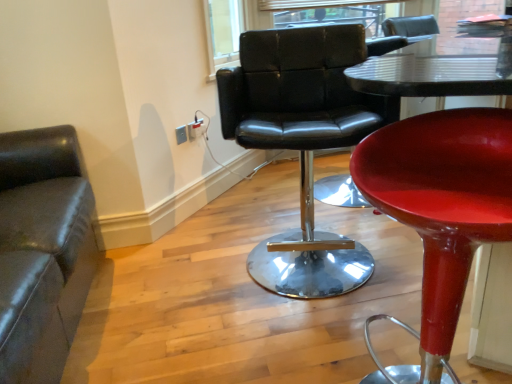
Question: Is black leather chair at center, placed as the second chair when sorted from right to left, at the left side of shiny red stool at center, the third chair when ordered from left to right?

Choices:
 (A) yes
 (B) no

Answer: (A)

Question: Is black leather chair at center, the 2th chair viewed from the left, positioned far away from shiny red stool at center, the third chair when ordered from left to right?

Choices:
 (A) yes
 (B) no

Answer: (B)

Question: Does black leather chair at center, the 2th chair viewed from the left, lie behind shiny red stool at center, the third chair when ordered from left to right?

Choices:
 (A) yes
 (B) no

Answer: (A)

Question: Is black leather chair at center, placed as the second chair when sorted from right to left, looking in the opposite direction of shiny red stool at center, the 1th chair in the right-to-left sequence?

Choices:
 (A) no
 (B) yes

Answer: (A)

Question: Could you tell me if black leather chair at center, placed as the second chair when sorted from right to left, is facing shiny red stool at center, the third chair when ordered from left to right?

Choices:
 (A) no
 (B) yes

Answer: (B)

Question: Considering the relative positions of black leather chair at center, placed as the second chair when sorted from right to left, and shiny red stool at center, the third chair when ordered from left to right, in the image provided, is black leather chair at center, placed as the second chair when sorted from right to left, in front of shiny red stool at center, the third chair when ordered from left to right,?

Choices:
 (A) yes
 (B) no

Answer: (B)

Question: Can matte white electrical outlet at upper center, which is the first electric outlet from front to back, be found inside shiny red stool at center, the 1th chair in the right-to-left sequence?

Choices:
 (A) no
 (B) yes

Answer: (A)

Question: Is shiny red stool at center, the 1th chair in the right-to-left sequence, facing away from matte white electrical outlet at upper center, the 2th electric outlet viewed from the back?

Choices:
 (A) yes
 (B) no

Answer: (B)

Question: From a real-world perspective, is shiny red stool at center, the 1th chair in the right-to-left sequence, physically below matte white electrical outlet at upper center, the 2th electric outlet viewed from the back?

Choices:
 (A) no
 (B) yes

Answer: (B)

Question: Considering the relative sizes of shiny red stool at center, the third chair when ordered from left to right, and matte white electrical outlet at upper center, the 2th electric outlet viewed from the back, in the image provided, is shiny red stool at center, the third chair when ordered from left to right, bigger than matte white electrical outlet at upper center, the 2th electric outlet viewed from the back,?

Choices:
 (A) no
 (B) yes

Answer: (B)

Question: Could you tell me if shiny red stool at center, the 1th chair in the right-to-left sequence, is facing matte white electrical outlet at upper center, which is the first electric outlet from front to back?

Choices:
 (A) no
 (B) yes

Answer: (A)

Question: Considering the relative sizes of shiny red stool at center, the 1th chair in the right-to-left sequence, and matte white electrical outlet at upper center, which is the first electric outlet from front to back, in the image provided, is shiny red stool at center, the 1th chair in the right-to-left sequence, shorter than matte white electrical outlet at upper center, which is the first electric outlet from front to back,?

Choices:
 (A) no
 (B) yes

Answer: (A)

Question: Is matte white electrical outlet at upper center, the 2th electric outlet viewed from the back, facing towards black leather chair at center, placed as the second chair when sorted from right to left?

Choices:
 (A) no
 (B) yes

Answer: (B)